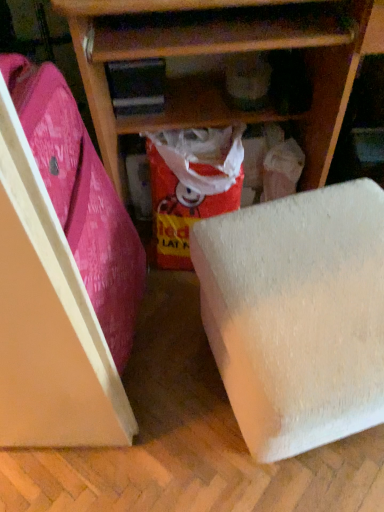
Question: Is red glossy paper at center not inside pink fabric suitcase at left?

Choices:
 (A) yes
 (B) no

Answer: (A)

Question: Is the position of red glossy paper at center less distant than that of pink fabric suitcase at left?

Choices:
 (A) no
 (B) yes

Answer: (A)

Question: Can you confirm if red glossy paper at center is smaller than pink fabric suitcase at left?

Choices:
 (A) yes
 (B) no

Answer: (A)

Question: From a real-world perspective, is red glossy paper at center positioned over pink fabric suitcase at left based on gravity?

Choices:
 (A) yes
 (B) no

Answer: (B)

Question: Considering the relative sizes of red glossy paper at center and pink fabric suitcase at left in the image provided, is red glossy paper at center thinner than pink fabric suitcase at left?

Choices:
 (A) yes
 (B) no

Answer: (B)

Question: Could you tell me if red glossy paper at center is turned towards pink fabric suitcase at left?

Choices:
 (A) yes
 (B) no

Answer: (B)

Question: Is pink fabric suitcase at left bigger than white foam block at lower right?

Choices:
 (A) no
 (B) yes

Answer: (B)

Question: Would you say white foam block at lower right is part of pink fabric suitcase at left's contents?

Choices:
 (A) no
 (B) yes

Answer: (A)

Question: Can you confirm if pink fabric suitcase at left is positioned to the left of white foam block at lower right?

Choices:
 (A) yes
 (B) no

Answer: (A)

Question: Is pink fabric suitcase at left shorter than white foam block at lower right?

Choices:
 (A) no
 (B) yes

Answer: (A)

Question: Is pink fabric suitcase at left not close to white foam block at lower right?

Choices:
 (A) yes
 (B) no

Answer: (B)

Question: From the image's perspective, is pink fabric suitcase at left located beneath white foam block at lower right?

Choices:
 (A) no
 (B) yes

Answer: (A)

Question: Is pink fabric suitcase at left further to camera compared to red glossy paper at center?

Choices:
 (A) yes
 (B) no

Answer: (B)